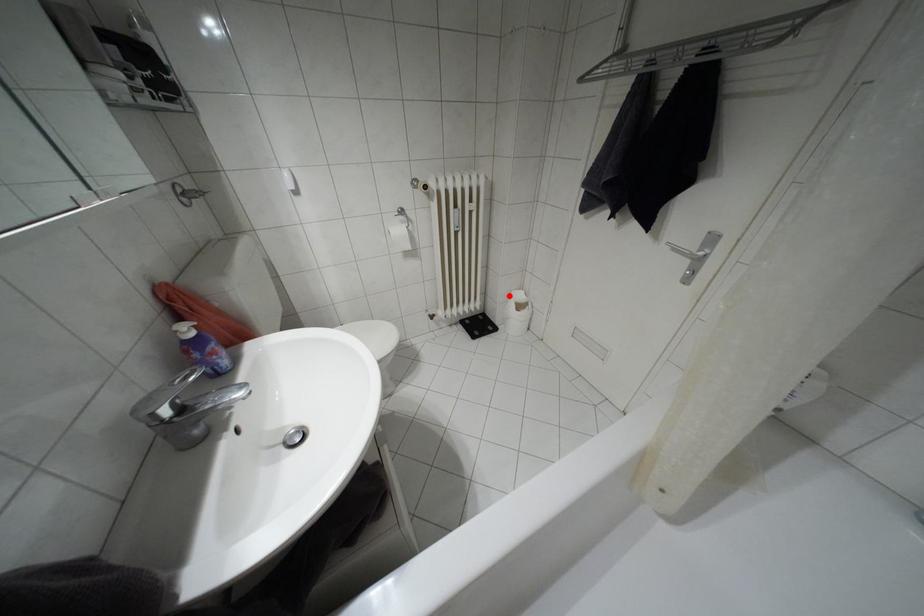
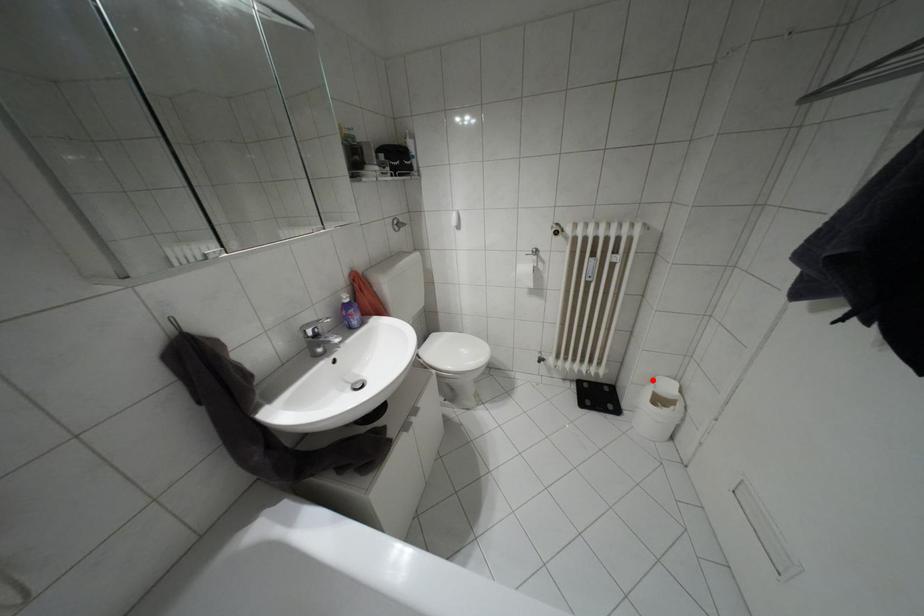
I am providing you with two images of the same scene from different viewpoints. A red point is marked on the first image and another point is marked on the second image. Does the point marked in image1 correspond to the same location as the one in image2?

Yes